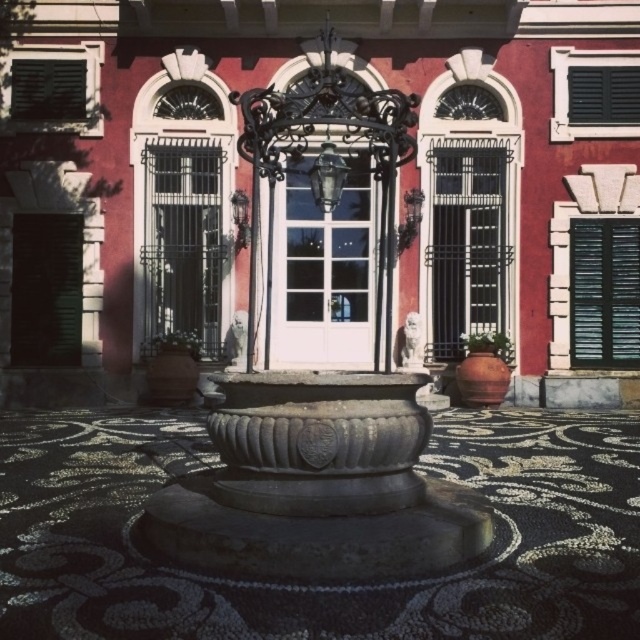
Based on the photo, can you confirm if black wooden shutter at right is smaller than black matte shutter at upper right?

No.

Is point (625, 349) less distant than point (612, 118)?

Yes, point (625, 349) is closer to viewer.

Where is `black wooden shutter at right`? black wooden shutter at right is located at coordinates (604, 292).

Does black wrought iron gate at center appear under green matte shutter at upper left?

Indeed, black wrought iron gate at center is positioned under green matte shutter at upper left.

Who is more distant from viewer, (163, 154) or (56, 100)?

Positioned behind is point (56, 100).

I want to click on black wrought iron gate at center, so click(x=182, y=240).

Who is positioned more to the left, white glossy door at center or green matte door at left?

Positioned to the left is green matte door at left.

Measure the distance between white glossy door at center and camera.

The distance of white glossy door at center from camera is 14.58 meters.

Which is behind, point (292, 320) or point (72, 240)?

Positioned behind is point (292, 320).

Where is `white glossy door at center`? The width and height of the screenshot is (640, 640). white glossy door at center is located at coordinates (323, 272).